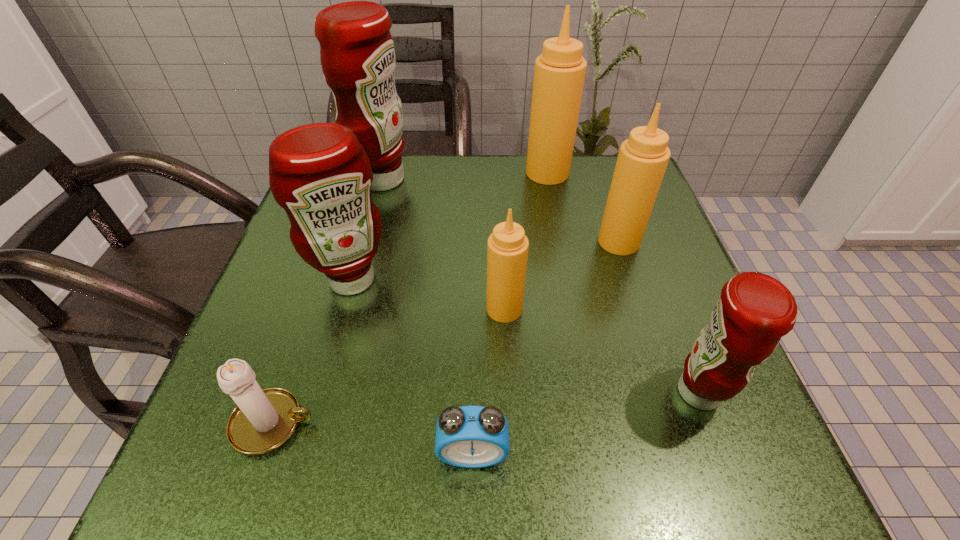
I want to click on the second tan condiment from right to left, so (559, 74).

Where is `the third object from right to left`? The width and height of the screenshot is (960, 540). the third object from right to left is located at coordinates (559, 74).

The width and height of the screenshot is (960, 540). I want to click on the farthest red condiment, so click(x=357, y=53).

Image resolution: width=960 pixels, height=540 pixels. Identify the location of the sixth nearest object. (643, 158).

Find the location of a particular element. the second smallest tan condiment is located at coordinates (643, 158).

The height and width of the screenshot is (540, 960). What are the coordinates of `the second farthest red condiment` in the screenshot? It's located at (319, 173).

The height and width of the screenshot is (540, 960). Find the location of `the nearest tan condiment`. the nearest tan condiment is located at coordinates (507, 250).

What are the coordinates of `the leftmost tan condiment` in the screenshot? It's located at (507, 250).

Identify the location of the smallest red condiment. The image size is (960, 540). (755, 310).

Locate an element on the screen. The width and height of the screenshot is (960, 540). the nearest condiment is located at coordinates (755, 310).